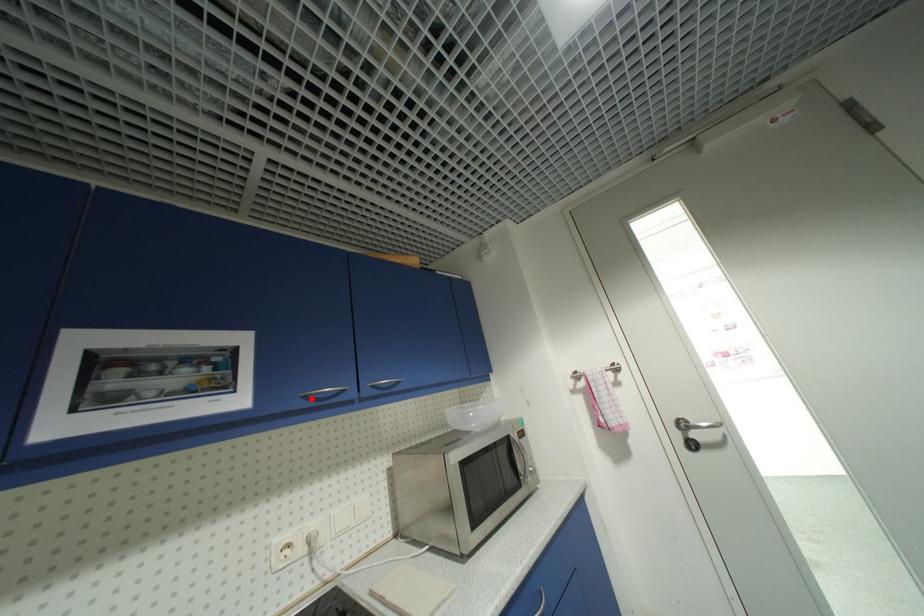
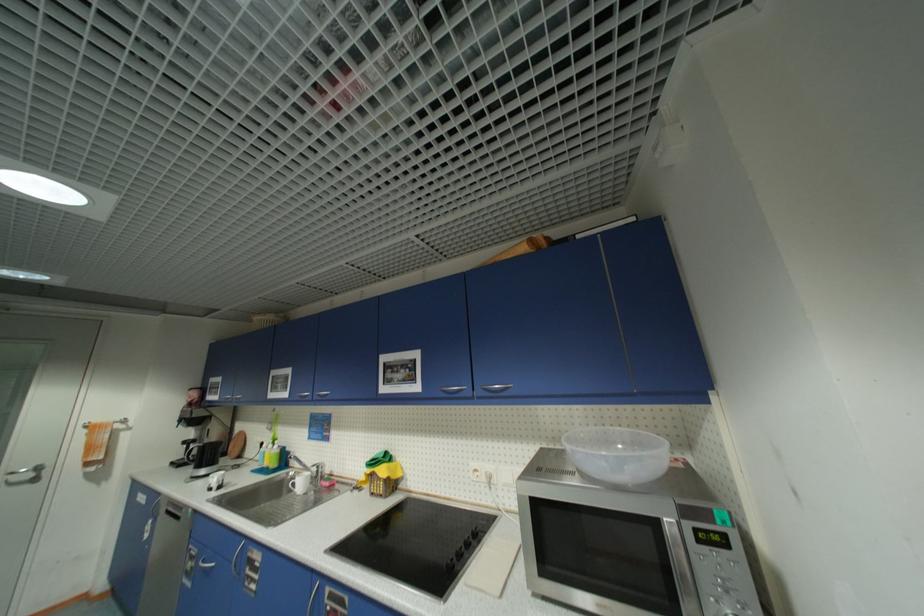
The point at the highlighted location is marked in the first image. Where is the corresponding point in the second image?

(448, 392)